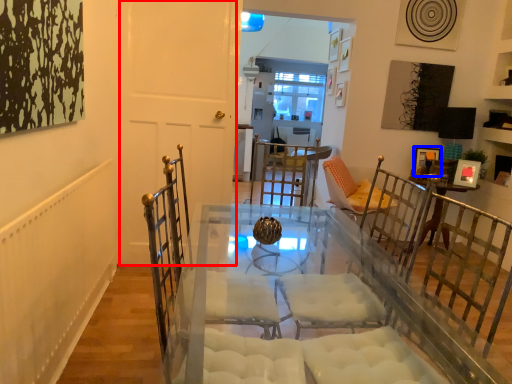
Question: Which point is further to the camera, door (highlighted by a red box) or picture frame (highlighted by a blue box)?

Choices:
 (A) door
 (B) picture frame

Answer: (B)